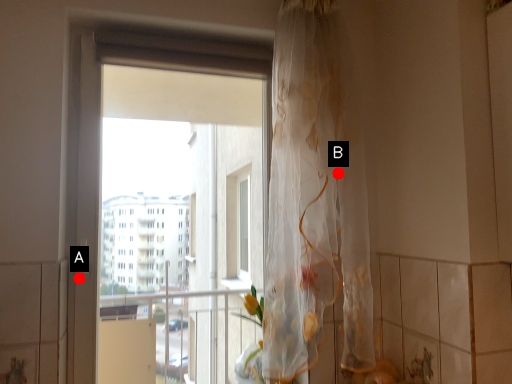
Question: Two points are circled on the image, labeled by A and B beside each circle. Which point is closer to the camera?

Choices:
 (A) A is closer
 (B) B is closer

Answer: (B)